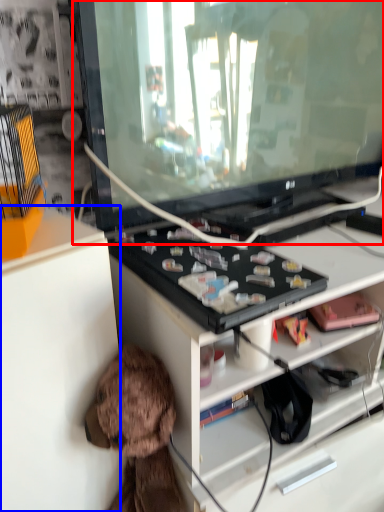
Question: Among these objects, which one is nearest to the camera, television (highlighted by a red box) or cabinetry (highlighted by a blue box)?

Choices:
 (A) television
 (B) cabinetry

Answer: (B)